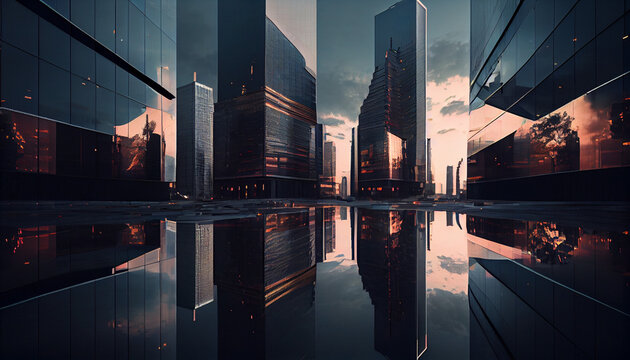
This screenshot has width=630, height=360. In order to click on lights on in the building in this screenshot , I will do `click(249, 67)`, `click(243, 88)`, `click(273, 157)`, `click(285, 160)`.